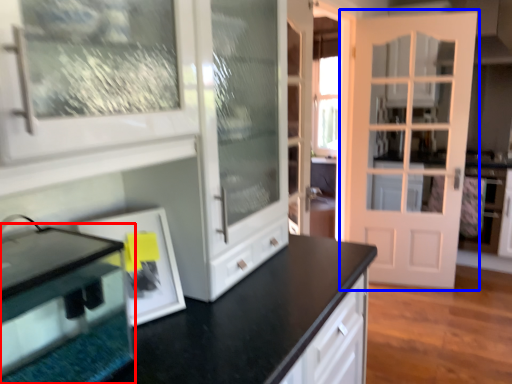
Question: Which object is further to the camera taking this photo, appliance (highlighted by a red box) or door (highlighted by a blue box)?

Choices:
 (A) appliance
 (B) door

Answer: (B)